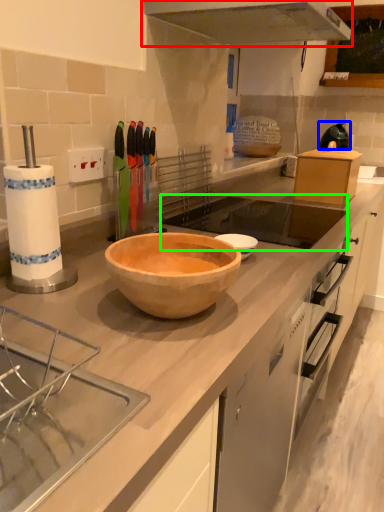
Question: Estimate the real-world distances between objects in this image. Which object is closer to exhaust hood (highlighted by a red box), appliance (highlighted by a blue box) or sink (highlighted by a green box)?

Choices:
 (A) appliance
 (B) sink

Answer: (B)